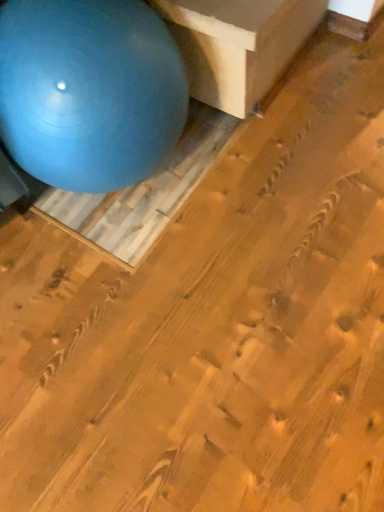
At what (x,y) coordinates should I click in order to perform the action: click on blue rubber ball at upper left. Please return your answer as a coordinate pair (x, y). This screenshot has width=384, height=512. Looking at the image, I should click on (89, 91).

The image size is (384, 512). Describe the element at coordinates (89, 91) in the screenshot. I see `blue rubber ball at upper left` at that location.

I want to click on blue rubber ball at upper left, so click(89, 91).